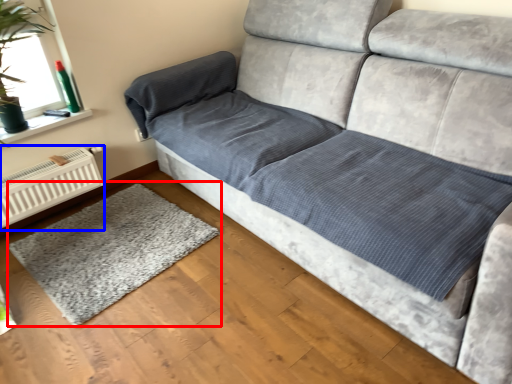
Question: Which object appears closest to the camera in this image, mat (highlighted by a red box) or radiator (highlighted by a blue box)?

Choices:
 (A) mat
 (B) radiator

Answer: (A)